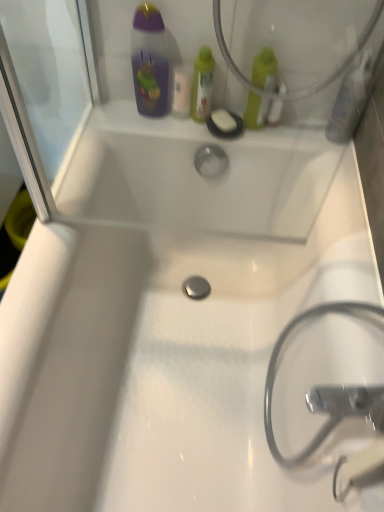
Question: Considering their positions, is green plastic bottle at upper center, which ranks as the second mouthwash in left-to-right order, located in front of or behind translucent plastic mouthwash at upper center, positioned as the first mouthwash in left-to-right order?

Choices:
 (A) behind
 (B) front

Answer: (B)

Question: From the image's perspective, is green plastic bottle at upper center, the fourth mouthwash positioned from the right, located above or below translucent plastic mouthwash at upper center, which appears as the fifth mouthwash when viewed from the right?

Choices:
 (A) below
 (B) above

Answer: (B)

Question: Which object is the closest to the metallic silver hose at lower right?

Choices:
 (A) translucent plastic mouthwash at upper center, which appears as the fifth mouthwash when viewed from the right
 (B) green matte bottle at upper right, placed as the 3th mouthwash when sorted from left to right
 (C) white matte soap at upper center
 (D) translucent plastic mouthwash at upper right, the 5th mouthwash positioned from the left
 (E) translucent plastic mouthwash at upper right, which appears as the 2th mouthwash when viewed from the right

Answer: (D)

Question: Considering the real-world distances, which object is farthest from the green plastic bottle at upper center, which ranks as the second mouthwash in left-to-right order?

Choices:
 (A) green matte bottle at upper right, placed as the 3th mouthwash when sorted from left to right
 (B) translucent plastic mouthwash at upper center, which appears as the fifth mouthwash when viewed from the right
 (C) translucent plastic mouthwash at upper right, the 5th mouthwash positioned from the left
 (D) translucent plastic mouthwash at upper right, which is the fourth mouthwash from left to right
 (E) metallic silver hose at lower right

Answer: (E)